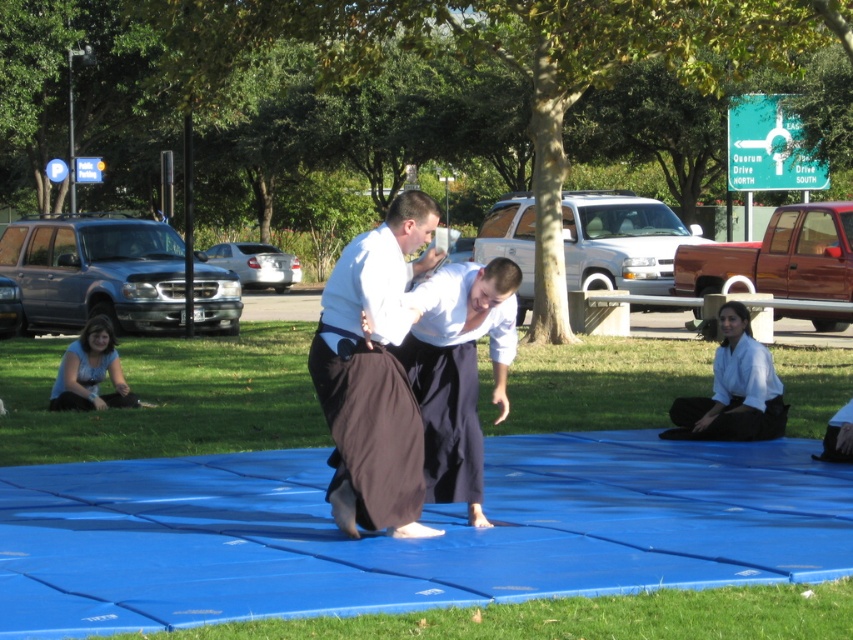
Question: Can you confirm if dark brown fabric kimono at center is bigger than blue fabric at lower left?

Choices:
 (A) yes
 (B) no

Answer: (B)

Question: Where is dark brown fabric kimono at center located in relation to blue fabric at lower left in the image?

Choices:
 (A) left
 (B) right

Answer: (B)

Question: Can you confirm if dark brown fabric kimono at center is positioned to the left of blue fabric at lower left?

Choices:
 (A) yes
 (B) no

Answer: (B)

Question: Which point is closer to the camera?

Choices:
 (A) dark brown fabric kimono at center
 (B) blue fabric at lower left

Answer: (A)